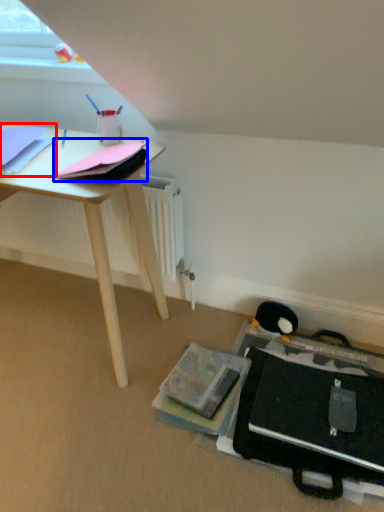
Question: Which of the following is the closest to the observer, paperback book (highlighted by a red box) or paperback book (highlighted by a blue box)?

Choices:
 (A) paperback book
 (B) paperback book

Answer: (B)